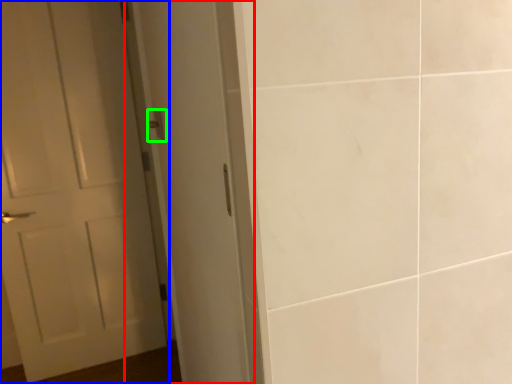
Question: Which is nearer to the screen door (highlighted by a red box)? door (highlighted by a blue box) or door handle (highlighted by a green box).

Choices:
 (A) door
 (B) door handle

Answer: (B)